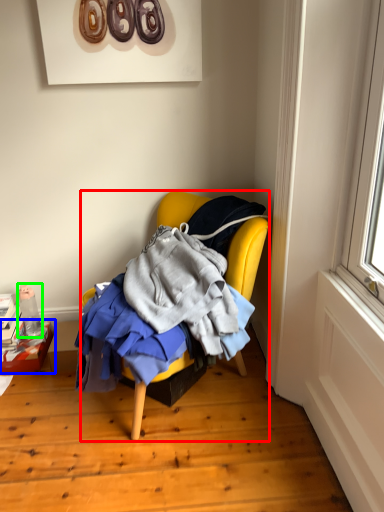
Question: Which is farther away from chair (highlighted by a red box)? box (highlighted by a blue box) or bottle (highlighted by a green box)?

Choices:
 (A) box
 (B) bottle

Answer: (A)